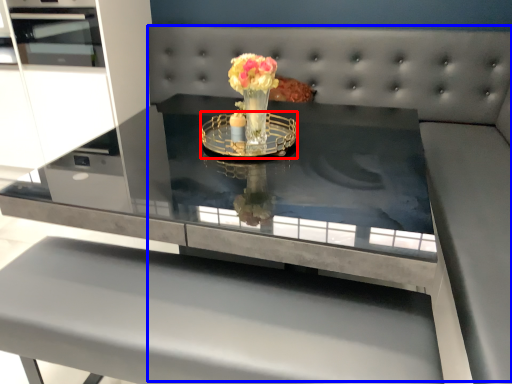
Question: Which object is closer to the camera taking this photo, glass plate (highlighted by a red box) or couch (highlighted by a blue box)?

Choices:
 (A) glass plate
 (B) couch

Answer: (B)